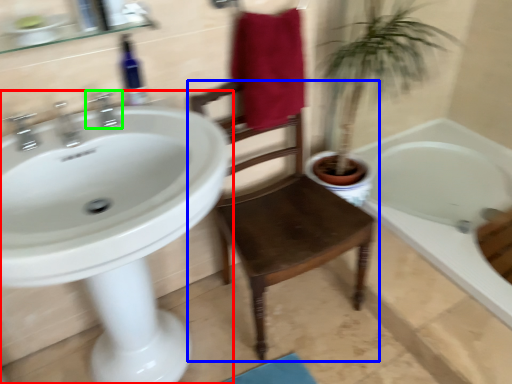
Question: Which object is positioned farthest from sink (highlighted by a red box)? Select from chair (highlighted by a blue box) and tap (highlighted by a green box).

Choices:
 (A) chair
 (B) tap

Answer: (A)